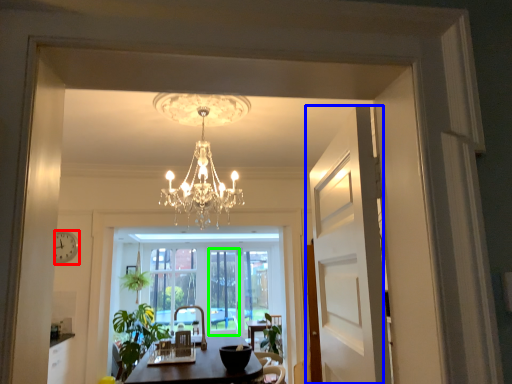
Question: Estimate the real-world distances between objects in this image. Which object is farther from clock (highlighted by a red box), door (highlighted by a blue box) or window screen (highlighted by a green box)?

Choices:
 (A) door
 (B) window screen

Answer: (A)